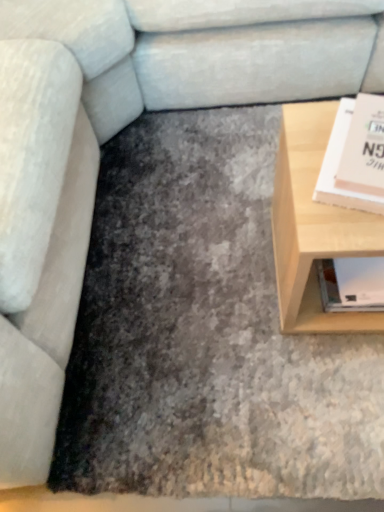
Locate an element on the screen. The width and height of the screenshot is (384, 512). free location in front of light wood table at right is located at coordinates (324, 393).